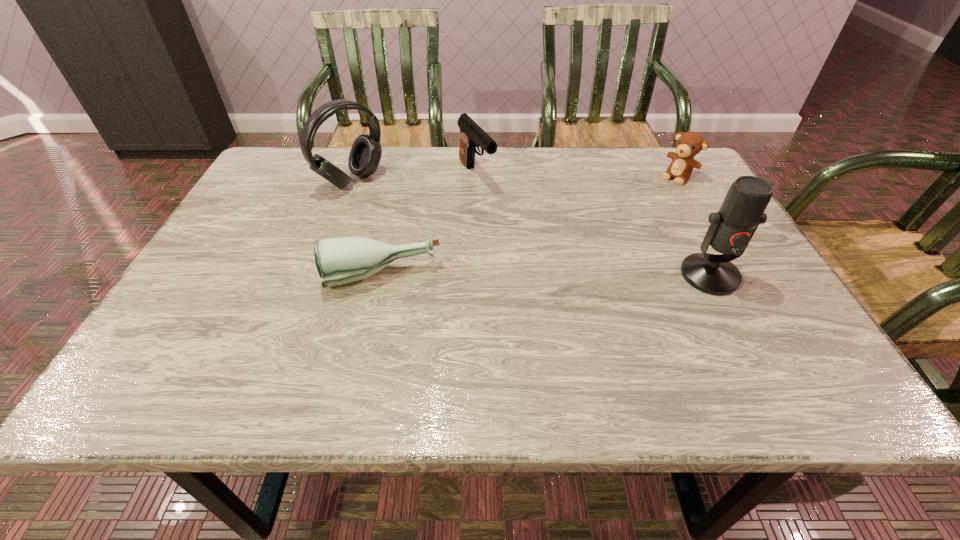
I want to click on microphone positioned at the right edge, so click(732, 227).

Find the location of a particular element. Image resolution: width=960 pixels, height=540 pixels. teddy bear that is positioned at the right edge is located at coordinates (689, 144).

You are a GUI agent. You are given a task and a screenshot of the screen. Output one action in this format:
    pyautogui.click(x=<x>, y=<y>)
    Task: Click on the object present at the far right corner
    
    Given the screenshot: What is the action you would take?
    click(689, 144)

You are a GUI agent. You are given a task and a screenshot of the screen. Output one action in this format:
    pyautogui.click(x=<x>, y=<y>)
    Task: Click on the vacant area at the far edge of the desktop
    The width and height of the screenshot is (960, 540).
    Given the screenshot: What is the action you would take?
    pyautogui.click(x=555, y=156)

The height and width of the screenshot is (540, 960). I want to click on free space at the near edge of the desktop, so click(400, 345).

The width and height of the screenshot is (960, 540). In the image, there is a desktop. What are the coordinates of `free space at the left edge` in the screenshot? It's located at (250, 235).

Identify the location of free spot at the right edge of the desktop. (716, 299).

This screenshot has height=540, width=960. I want to click on free space between the headset and the second shortest object, so click(515, 179).

Where is `free point between the microphone and the headset`? This screenshot has width=960, height=540. free point between the microphone and the headset is located at coordinates (531, 228).

Locate an element on the screen. The image size is (960, 540). free spot between the third shortest object and the headset is located at coordinates (414, 178).